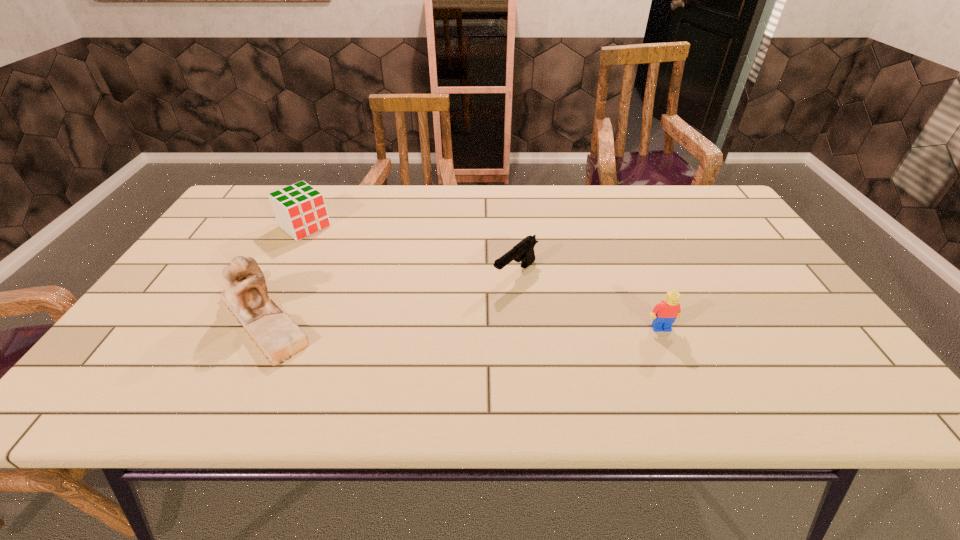
The width and height of the screenshot is (960, 540). Find the location of `the tallest object`. the tallest object is located at coordinates (274, 332).

Where is `the rightmost object`? This screenshot has height=540, width=960. the rightmost object is located at coordinates (665, 313).

At what (x,y) coordinates should I click in order to perform the action: click on the third object from left to right. Please return your answer as a coordinate pair (x, y). The image size is (960, 540). Looking at the image, I should click on (523, 251).

This screenshot has height=540, width=960. Identify the location of the shortest object. (523, 251).

The height and width of the screenshot is (540, 960). I want to click on the farthest object, so click(300, 210).

This screenshot has height=540, width=960. In order to click on blank space located 0.050m on the face of the rightmost object in this screenshot , I will do `click(670, 350)`.

Locate an element on the screen. vacant area situated 0.070m on the front-facing side of the third object from left to right is located at coordinates (483, 301).

Where is `vacant space situated 0.310m on the front-facing side of the third object from left to right`? vacant space situated 0.310m on the front-facing side of the third object from left to right is located at coordinates (410, 360).

Locate an element on the screen. The width and height of the screenshot is (960, 540). vacant area located 0.070m on the front-facing side of the third object from left to right is located at coordinates (483, 301).

Locate an element on the screen. This screenshot has height=540, width=960. vacant space located on the red face of the cube is located at coordinates (349, 261).